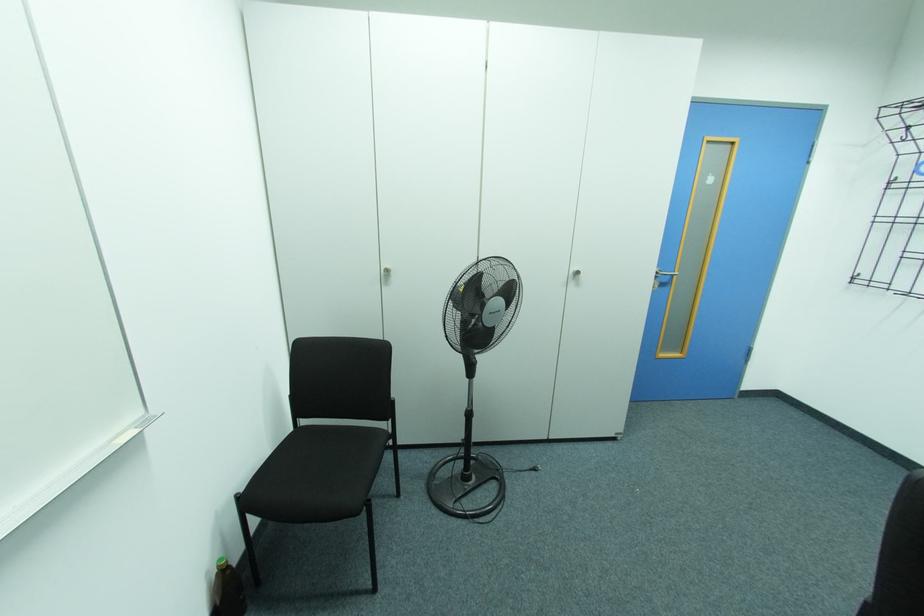
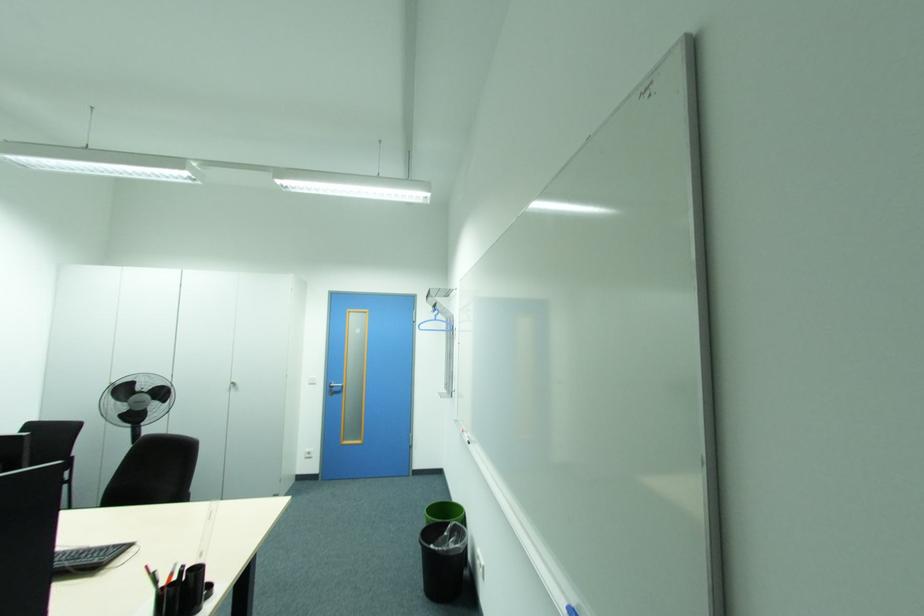
The images are taken continuously from a first-person perspective. In which direction are you moving?

The cameraman walked toward right, backward.